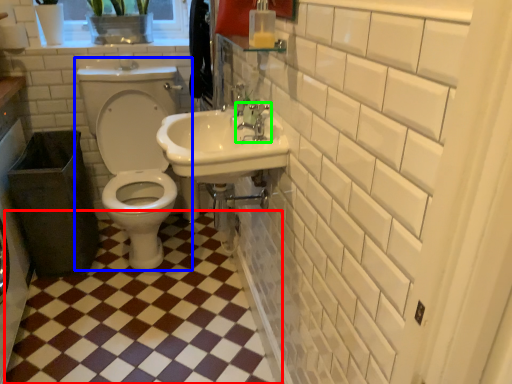
Question: Which object is positioned closest to ceramic tile (highlighted by a red box)? Select from toilet (highlighted by a blue box) and tap (highlighted by a green box).

Choices:
 (A) toilet
 (B) tap

Answer: (A)